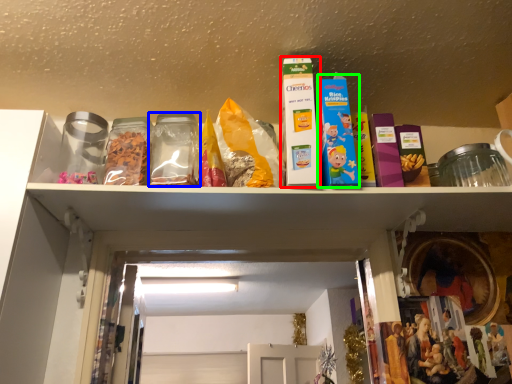
Question: Estimate the real-world distances between objects in this image. Which object is closer to product (highlighted by a red box), glass jar (highlighted by a blue box) or product (highlighted by a green box)?

Choices:
 (A) glass jar
 (B) product

Answer: (B)